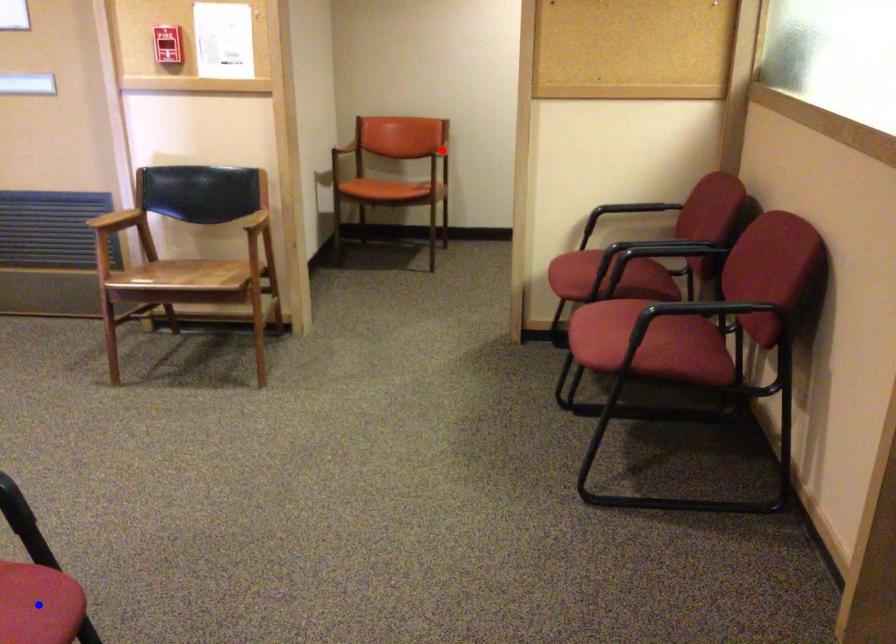
Question: Which of the two points in the image is closer to the camera?

Choices:
 (A) Blue point is closer.
 (B) Red point is closer.

Answer: (A)